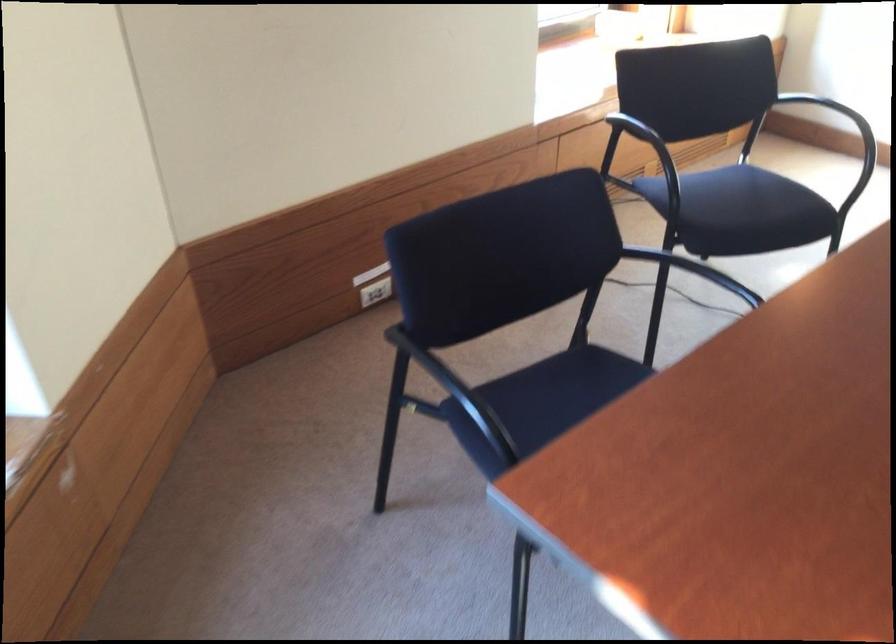
Describe the element at coordinates (373, 285) in the screenshot. The image size is (896, 644). I see `a white wall outlet` at that location.